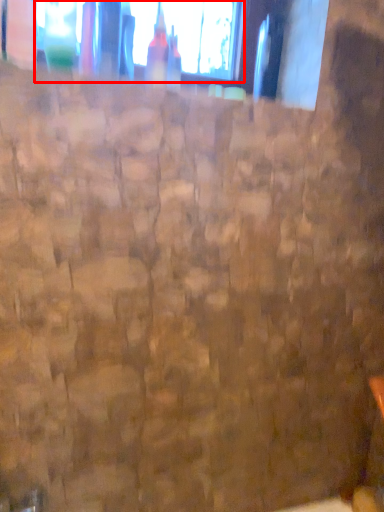
Question: In this image, where is window (annotated by the red box) located relative to bottle?

Choices:
 (A) right
 (B) left

Answer: (A)